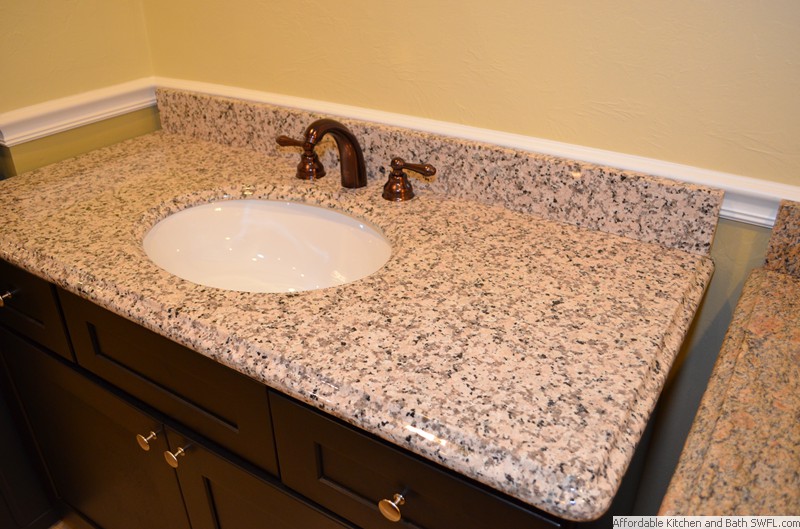
You are a GUI agent. You are given a task and a screenshot of the screen. Output one action in this format:
    pyautogui.click(x=<x>, y=<y>)
    Task: Click on the molding
    This screenshot has height=529, width=800.
    Given the screenshot: What is the action you would take?
    pyautogui.click(x=108, y=114)